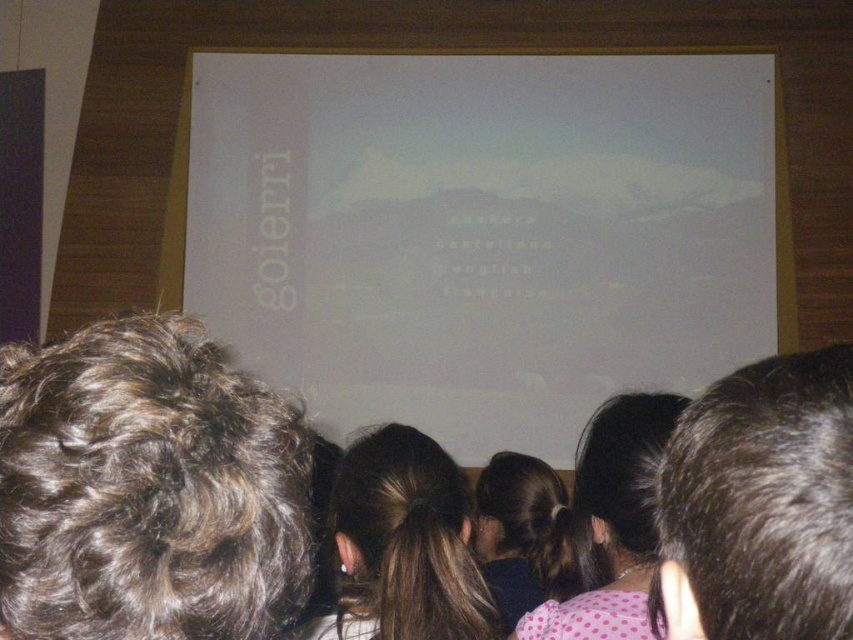
Question: Which is farther from the dark brown hair at upper right?

Choices:
 (A) dark curly hair at upper left
 (B) dark brown hair at center
 (C) pink dotted shirt at center
 (D) white matte projection screen at center

Answer: (D)

Question: Which point is farther to the camera?

Choices:
 (A) dark brown hair at center
 (B) dark brown hair at upper right
 (C) pink dotted shirt at center
 (D) dark curly hair at upper left

Answer: (A)

Question: Can you confirm if dark brown hair at upper right is smaller than pink dotted shirt at center?

Choices:
 (A) yes
 (B) no

Answer: (A)

Question: Estimate the real-world distances between objects in this image. Which object is farther from the white matte projection screen at center?

Choices:
 (A) pink dotted shirt at center
 (B) dark curly hair at upper left
 (C) dark brown hair at upper right

Answer: (C)

Question: Does dark brown hair at upper right lie in front of dark brown hair at center?

Choices:
 (A) yes
 (B) no

Answer: (A)

Question: Does dark curly hair at upper left have a greater width compared to dark brown hair at center?

Choices:
 (A) yes
 (B) no

Answer: (B)